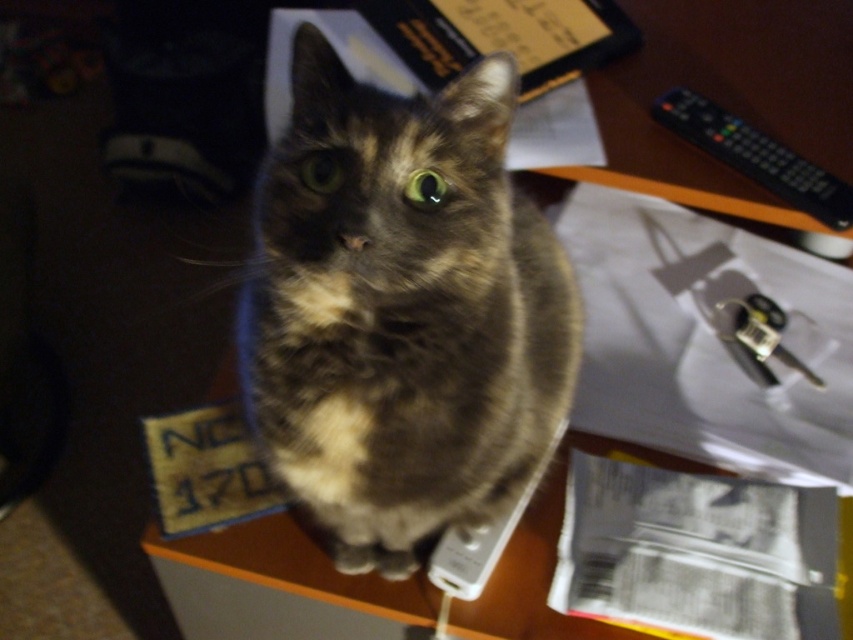
You need to place a new item on the desk that must fit between the tabby fur cat at center and the black plastic remote at upper right. Based on their sizes, can the item be placed there?

The tabby fur cat at center might be wider than black plastic remote at upper right, so there may not be enough space between them to place the new item.

You are a photographer trying to capture a clear shot of the tabby fur cat at center and the black plastic remote at upper right. Since the cat is blocking the remote, can you adjust your camera angle to focus on the remote without moving the cat?

The tabby fur cat at center is taller than the black plastic remote at upper right, so you can lower your camera angle to focus on the remote while keeping the cat in the frame but slightly out of focus.

You are a photographer trying to capture a closeup shot of the tabby fur cat at center. Your camera requires the subject to be at least 24 inches away to focus properly. Based on the scene description, can you take the photo without moving either the cat or the camera?

The distance between the tabby fur cat at center and the camera is 22.13 inches, which is less than the required 24 inches for proper focus. Therefore, you cannot take the photo without moving the cat or the camera to increase the distance.